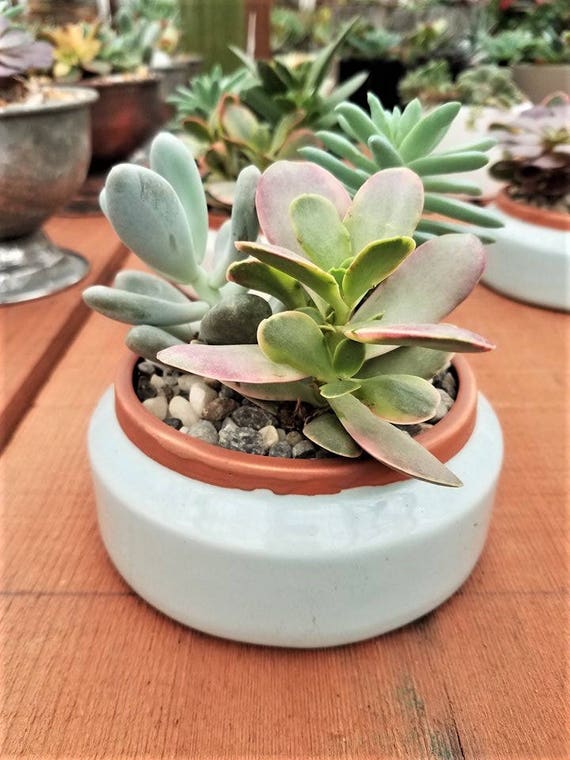
Locate an element on the screen. The width and height of the screenshot is (570, 760). spiky plant is located at coordinates (400, 154).